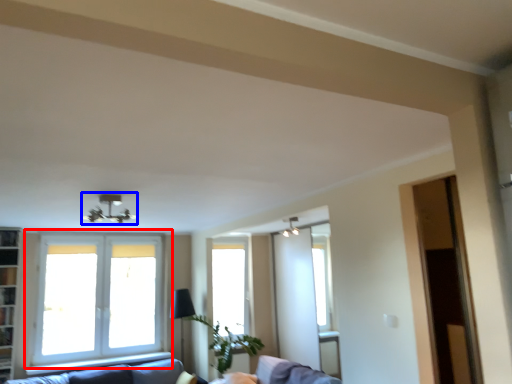
Question: Which point is further to the camera, window (highlighted by a red box) or light fixture (highlighted by a blue box)?

Choices:
 (A) window
 (B) light fixture

Answer: (A)